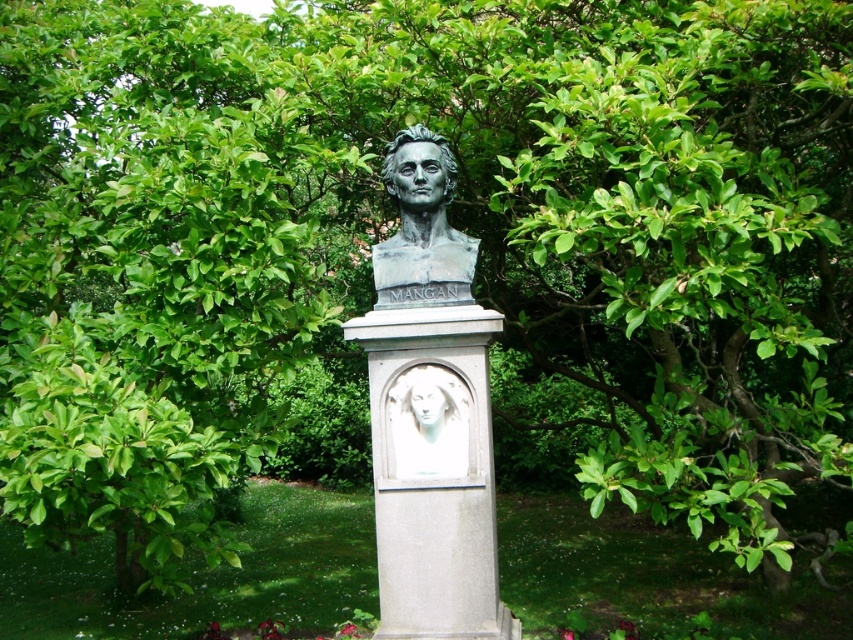
Is bronze bust at center further to the viewer compared to white marble relief at center?

Yes, bronze bust at center is further from the viewer.

Is point (442, 148) positioned in front of point (433, 420)?

No, (442, 148) is further to viewer.

Where is `bronze bust at center`? Image resolution: width=853 pixels, height=640 pixels. bronze bust at center is located at coordinates 422,227.

At what (x,y) coordinates should I click in order to perform the action: click on bronze bust at center. Please return your answer as a coordinate pair (x, y). The image size is (853, 640). Looking at the image, I should click on (422, 227).